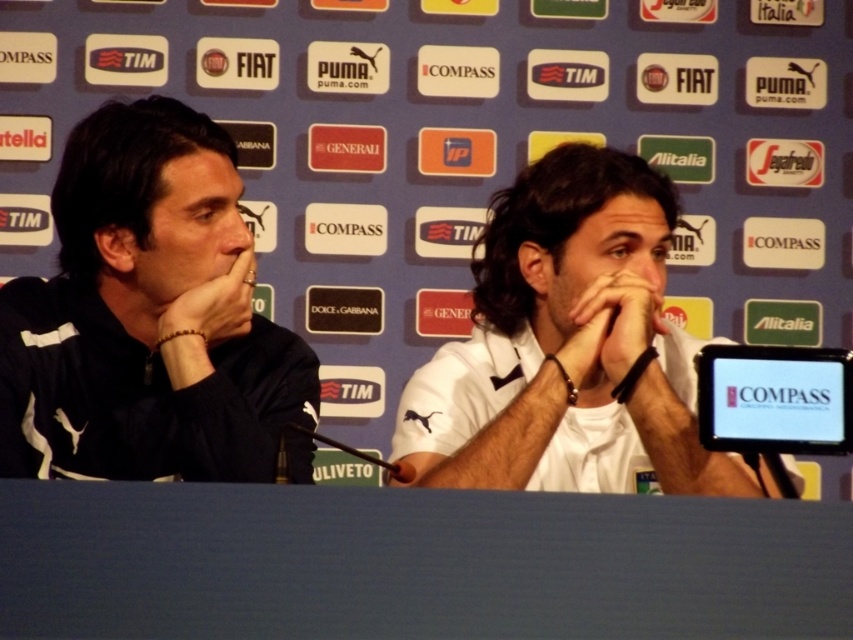
Is the position of dark blue jersey at left more distant than that of white matte shirt at center?

Yes.

This screenshot has width=853, height=640. Describe the element at coordinates (148, 316) in the screenshot. I see `dark blue jersey at left` at that location.

This screenshot has height=640, width=853. Identify the location of dark blue jersey at left. (148, 316).